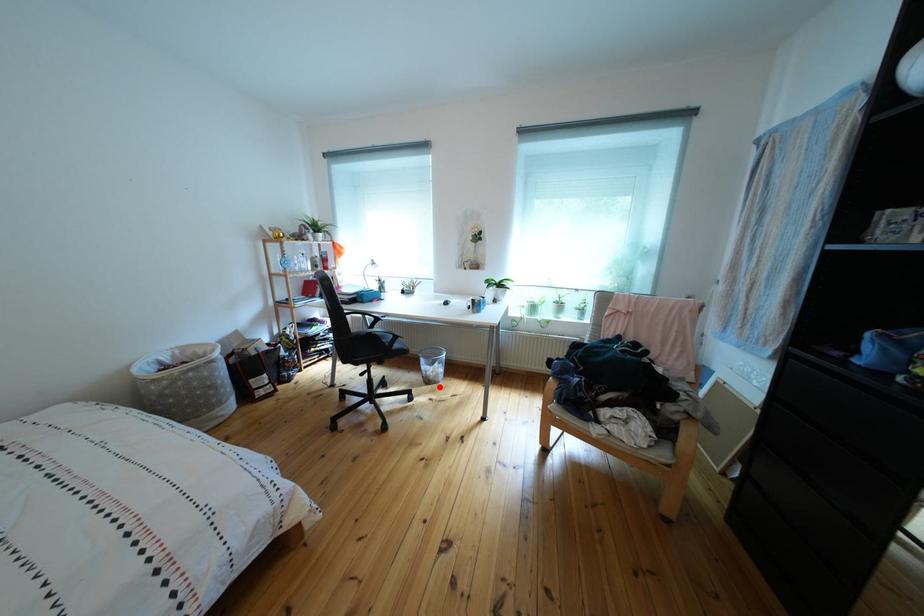
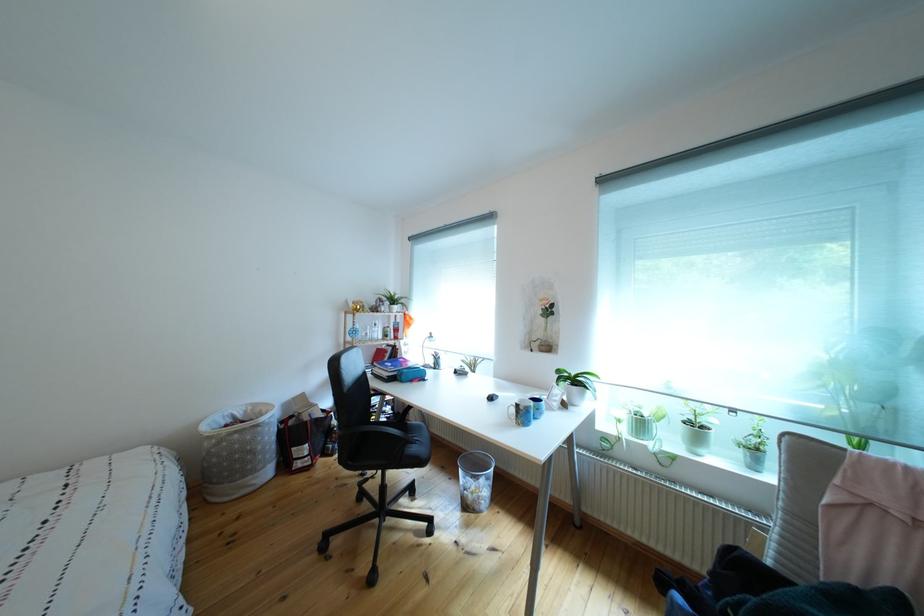
The point at the highlighted location is marked in the first image. Where is the corresponding point in the second image?

(477, 512)